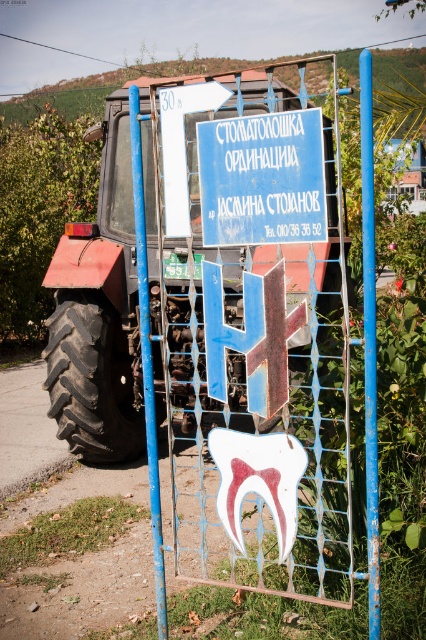
Can you confirm if rustic metal tractor at left is smaller than blue painted metal sign at center?

Actually, rustic metal tractor at left might be larger than blue painted metal sign at center.

Is rustic metal tractor at left above blue painted metal sign at center?

No, rustic metal tractor at left is not above blue painted metal sign at center.

Which is in front, point (199, 364) or point (310, 205)?

Point (310, 205) is more forward.

What are the coordinates of `rustic metal tractor at left` in the screenshot? It's located at (98, 314).